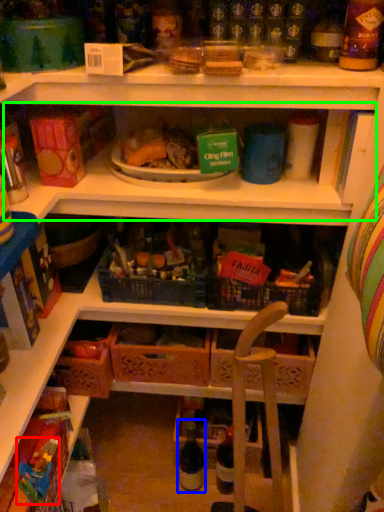
Question: Estimate the real-world distances between objects in this image. Which object is farther from toy (highlighted by a red box), bottle (highlighted by a blue box) or shelf (highlighted by a green box)?

Choices:
 (A) bottle
 (B) shelf

Answer: (B)